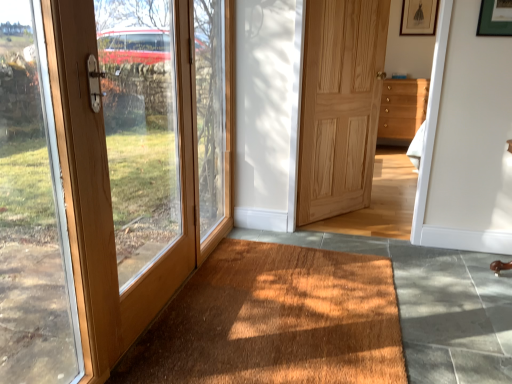
This screenshot has width=512, height=384. What do you see at coordinates (419, 17) in the screenshot? I see `matte black picture frame at upper right` at bounding box center [419, 17].

Where is `wooden chest of drawers at center-right`? This screenshot has height=384, width=512. wooden chest of drawers at center-right is located at coordinates (402, 110).

Describe the element at coordinates (32, 214) in the screenshot. I see `wooden door at left` at that location.

Locate an element on the screen. The image size is (512, 384). matte black picture frame at upper right is located at coordinates (419, 17).

Is natural wood door at center, the 2th door positioned from the left, behind matte wood door at left, positioned as the second door in back-to-front order?

Yes, natural wood door at center, the 2th door positioned from the left, is further from the camera.

Is natural wood door at center, the 2th door positioned from the left, with matte wood door at left, placed as the 1th door when sorted from front to back?

No, natural wood door at center, the 2th door positioned from the left, is not next to matte wood door at left, placed as the 1th door when sorted from front to back.

In the scene shown: Is natural wood door at center, marked as the first door in a back-to-front arrangement, thinner than matte wood door at left, which ranks as the 1th door in left-to-right order?

Correct, the width of natural wood door at center, marked as the first door in a back-to-front arrangement, is less than that of matte wood door at left, which ranks as the 1th door in left-to-right order.

In the scene shown: Considering the positions of objects natural wood door at center, the 2th door positioned from the left, and matte wood door at left, which ranks as the 1th door in left-to-right order, in the image provided, who is more to the right, natural wood door at center, the 2th door positioned from the left, or matte wood door at left, which ranks as the 1th door in left-to-right order,?

natural wood door at center, the 2th door positioned from the left, is more to the right.

Considering the relative positions of wooden door at left and brown textured mat at lower center in the image provided, is wooden door at left to the left of brown textured mat at lower center from the viewer's perspective?

Yes.

Is there a large distance between wooden door at left and brown textured mat at lower center?

No, wooden door at left is not far from brown textured mat at lower center.

In the image, is wooden door at left positioned in front of or behind brown textured mat at lower center?

wooden door at left is in front of brown textured mat at lower center.

Who is smaller, matte wood door at left, placed as the 1th door when sorted from front to back, or matte black picture frame at upper right?

With smaller size is matte black picture frame at upper right.

Is point (62, 86) behind point (415, 30)?

That is False.

Considering the relative sizes of matte wood door at left, which ranks as the 1th door in left-to-right order, and matte black picture frame at upper right in the image provided, is matte wood door at left, which ranks as the 1th door in left-to-right order, thinner than matte black picture frame at upper right?

No.

Considering the sizes of objects matte wood door at left, which ranks as the 1th door in left-to-right order, and matte black picture frame at upper right in the image provided, who is shorter, matte wood door at left, which ranks as the 1th door in left-to-right order, or matte black picture frame at upper right?

With less height is matte black picture frame at upper right.

Is there a large distance between natural wood door at center, which appears as the 2th door when viewed from the front, and wooden chest of drawers at center-right?

No, natural wood door at center, which appears as the 2th door when viewed from the front, is not far from wooden chest of drawers at center-right.

Identify the location of chest of drawers below the natural wood door at center, the 2th door positioned from the left (from a real-world perspective). This screenshot has height=384, width=512. (402, 110).

Does natural wood door at center, marked as the first door in a back-to-front arrangement, lie behind wooden chest of drawers at center-right?

No, natural wood door at center, marked as the first door in a back-to-front arrangement, is in front of wooden chest of drawers at center-right.

Is matte black picture frame at upper right touching natural wood door at center, marked as the first door in a back-to-front arrangement?

No, matte black picture frame at upper right is not with natural wood door at center, marked as the first door in a back-to-front arrangement.

From the image's perspective, is matte black picture frame at upper right above or below natural wood door at center, which is counted as the first door, starting from the right?

matte black picture frame at upper right is above natural wood door at center, which is counted as the first door, starting from the right.

In terms of height, does matte black picture frame at upper right look taller or shorter compared to natural wood door at center, which is counted as the first door, starting from the right?

Considering their sizes, matte black picture frame at upper right has less height than natural wood door at center, which is counted as the first door, starting from the right.

The height and width of the screenshot is (384, 512). I want to click on the chest of drawers lying in front of the matte black picture frame at upper right, so click(x=402, y=110).

Does point (410, 14) come behind point (412, 116)?

No.

Looking at their sizes, would you say matte black picture frame at upper right is wider or thinner than wooden chest of drawers at center-right?

matte black picture frame at upper right is thinner than wooden chest of drawers at center-right.

How many degrees apart are the facing directions of brown textured mat at lower center and natural wood door at center, the 2th door positioned from the left?

36.8 degrees separate the facing orientations of brown textured mat at lower center and natural wood door at center, the 2th door positioned from the left.

In the image, is brown textured mat at lower center positioned in front of or behind natural wood door at center, marked as the first door in a back-to-front arrangement?

Clearly, brown textured mat at lower center is in front of natural wood door at center, marked as the first door in a back-to-front arrangement.

Considering the positions of objects brown textured mat at lower center and natural wood door at center, marked as the first door in a back-to-front arrangement, in the image provided, who is more to the left, brown textured mat at lower center or natural wood door at center, marked as the first door in a back-to-front arrangement,?

From the viewer's perspective, brown textured mat at lower center appears more on the left side.

Looking at this image, which point is more distant from viewer, (294, 374) or (341, 201)?

The point (341, 201) is farther.

Find the location of a particular element. door above the matte wood door at left, which ranks as the 1th door in left-to-right order (from the image's perspective) is located at coordinates 340,105.

Image resolution: width=512 pixels, height=384 pixels. In the image, there is a wooden door at left. Find the location of `doormat below it (from the image's perspective)`. doormat below it (from the image's perspective) is located at coordinates (275, 321).

Looking at the image, which one is located further to brown textured mat at lower center, wooden chest of drawers at center-right or matte black picture frame at upper right?

wooden chest of drawers at center-right is positioned further to the anchor brown textured mat at lower center.

Which object lies nearer to the anchor point brown textured mat at lower center, natural wood door at center, marked as the first door in a back-to-front arrangement, or wooden chest of drawers at center-right?

natural wood door at center, marked as the first door in a back-to-front arrangement, is closer to brown textured mat at lower center.

Based on their spatial positions, is natural wood door at center, the 2th door positioned from the left, or matte black picture frame at upper right further from brown textured mat at lower center?

matte black picture frame at upper right lies further to brown textured mat at lower center than the other object.

Estimate the real-world distances between objects in this image. Which object is further from natural wood door at center, marked as the first door in a back-to-front arrangement, wooden chest of drawers at center-right or brown textured mat at lower center?

brown textured mat at lower center is further to natural wood door at center, marked as the first door in a back-to-front arrangement.

When comparing their distances from wooden door at left, does matte wood door at left, the second door in the right-to-left sequence, or wooden chest of drawers at center-right seem further?

wooden chest of drawers at center-right is positioned further to the anchor wooden door at left.

From the image, which object appears to be nearer to matte wood door at left, the second door in the right-to-left sequence, wooden chest of drawers at center-right or wooden door at left?

The object closer to matte wood door at left, the second door in the right-to-left sequence, is wooden door at left.

Based on their spatial positions, is wooden chest of drawers at center-right or matte black picture frame at upper right further from natural wood door at center, marked as the first door in a back-to-front arrangement?

wooden chest of drawers at center-right is positioned further to the anchor natural wood door at center, marked as the first door in a back-to-front arrangement.

Which object lies further to the anchor point wooden chest of drawers at center-right, wooden door at left or matte black picture frame at upper right?

The object further to wooden chest of drawers at center-right is wooden door at left.

Where is `doormat positioned between wooden door at left and matte black picture frame at upper right from near to far`? doormat positioned between wooden door at left and matte black picture frame at upper right from near to far is located at coordinates (275, 321).

You are a GUI agent. You are given a task and a screenshot of the screen. Output one action in this format:
    pyautogui.click(x=<x>, y=<y>)
    Task: Click on the door between brown textured mat at lower center and matte black picture frame at upper right along the z-axis
    This screenshot has height=384, width=512.
    Given the screenshot: What is the action you would take?
    pyautogui.click(x=340, y=105)

This screenshot has width=512, height=384. I want to click on the chest of drawers positioned between matte wood door at left, which ranks as the 1th door in left-to-right order, and matte black picture frame at upper right from near to far, so click(x=402, y=110).

The height and width of the screenshot is (384, 512). I want to click on doormat between matte wood door at left, which ranks as the 1th door in left-to-right order, and wooden chest of drawers at center-right in the front-back direction, so click(275, 321).